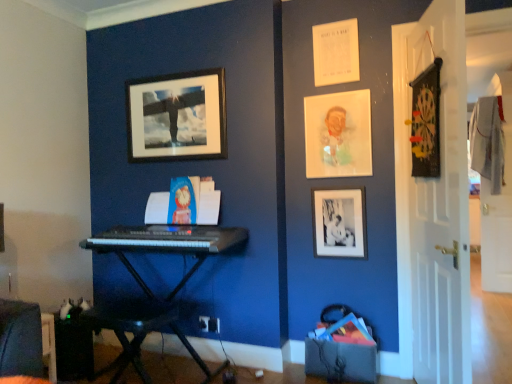
Question: Does point (5, 321) appear closer or farther from the camera than point (316, 130)?

Choices:
 (A) closer
 (B) farther

Answer: (A)

Question: Considering the positions of velvet dark blue swivel chair at lower left and matte plastic portrait at upper right, the 2th picture frame in the left-to-right sequence, in the image, is velvet dark blue swivel chair at lower left bigger or smaller than matte plastic portrait at upper right, the 2th picture frame in the left-to-right sequence,?

Choices:
 (A) big
 (B) small

Answer: (A)

Question: Estimate the real-world distances between objects in this image. Which object is farther from the black plastic keyboard at lower left?

Choices:
 (A) white wood door at right, which appears as the 1th door when viewed from the right
 (B) black matte picture frame at upper center, arranged as the 1th picture frame when viewed from the left
 (C) black plastic keyboard at center
 (D) velvet dark blue swivel chair at lower left
 (E) black matte picture frame at lower right, which is the 1th picture frame from right to left

Answer: (A)

Question: Estimate the real-world distances between objects in this image. Which object is closer to the black plastic keyboard at center?

Choices:
 (A) white wood door at right, which appears as the 1th door when viewed from the right
 (B) velvet dark blue swivel chair at lower left
 (C) black matte picture frame at upper center, the 3th picture frame from the right
 (D) matte plastic portrait at upper right, the 2th picture frame in the left-to-right sequence
 (E) black plastic keyboard at center

Answer: (E)